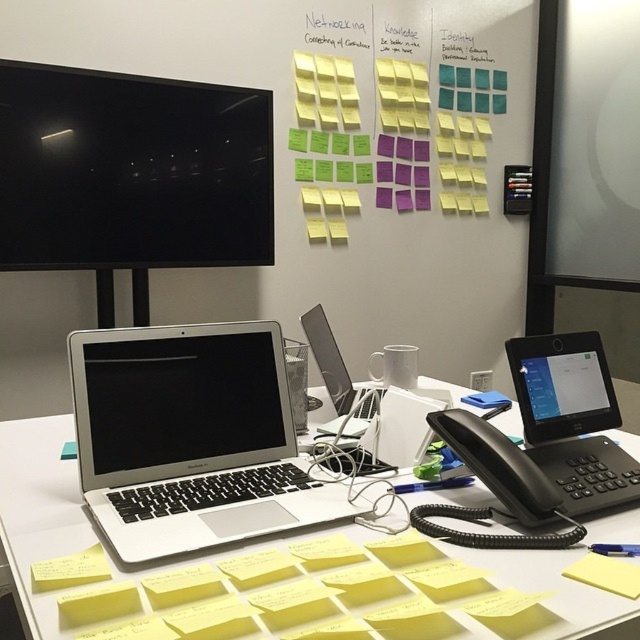
Question: Which object appears farthest from the camera in this image?

Choices:
 (A) yellow paper at lower right
 (B) silver metallic laptop at lower left
 (C) yellow paper at lower left
 (D) black glossy monitor at upper left

Answer: (D)

Question: Is black glossy monitor at upper left to the right of silver metallic laptop at center from the viewer's perspective?

Choices:
 (A) yes
 (B) no

Answer: (B)

Question: Which object appears closest to the camera in this image?

Choices:
 (A) silver metallic laptop at lower left
 (B) silver metallic laptop at center
 (C) yellow paper at lower right
 (D) black glossy monitor at upper left

Answer: (A)

Question: Which object appears farthest from the camera in this image?

Choices:
 (A) silver metallic laptop at lower left
 (B) silver metallic laptop at center
 (C) black glossy monitor at upper left
 (D) yellow paper at lower right

Answer: (C)

Question: Is silver metallic laptop at center below yellow paper at lower left?

Choices:
 (A) no
 (B) yes

Answer: (A)

Question: In this image, where is black glossy monitor at upper left located relative to silver metallic laptop at center?

Choices:
 (A) above
 (B) below

Answer: (A)